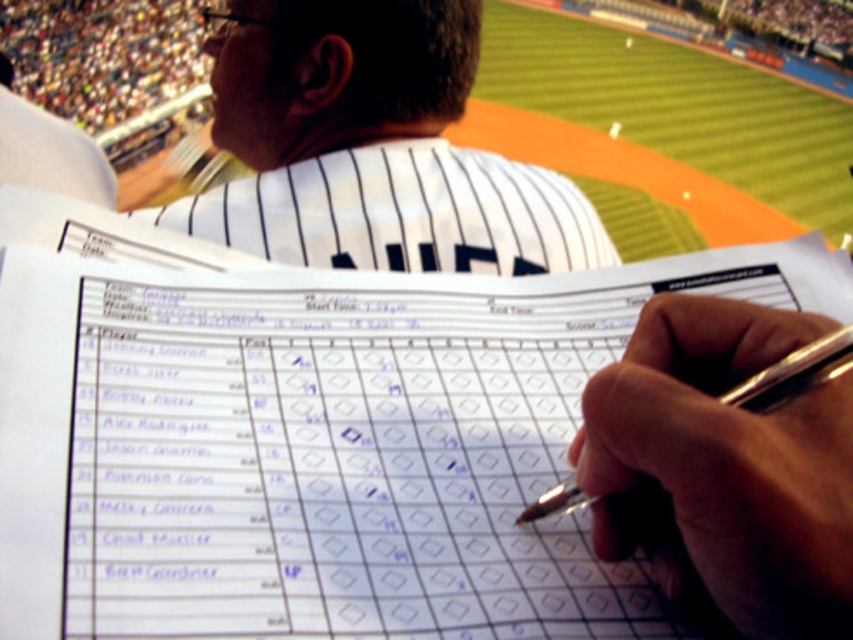
Question: Is white pinstriped jersey at upper center closer to the viewer compared to silver metallic pen at center?

Choices:
 (A) yes
 (B) no

Answer: (B)

Question: Which point is closer to the camera?

Choices:
 (A) (741, 401)
 (B) (343, 84)

Answer: (A)

Question: Which object appears closest to the camera in this image?

Choices:
 (A) white pinstriped jersey at upper center
 (B) silver metallic pen at center

Answer: (B)

Question: Where is white pinstriped jersey at upper center located in relation to silver metallic pen at center in the image?

Choices:
 (A) left
 (B) right

Answer: (A)

Question: Can you confirm if white pinstriped jersey at upper center is wider than silver metallic pen at center?

Choices:
 (A) yes
 (B) no

Answer: (A)